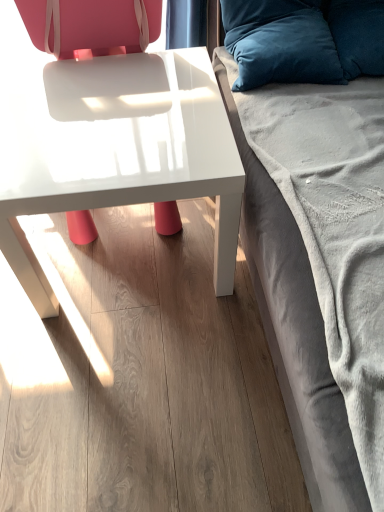
Question: Does velvety blue pillow at upper right, the 2th pillow when ordered from left to right, lie behind velvet gray studio couch at right?

Choices:
 (A) yes
 (B) no

Answer: (A)

Question: Would you say velvety blue pillow at upper right, acting as the 1th pillow starting from the right, contains velvet gray studio couch at right?

Choices:
 (A) yes
 (B) no

Answer: (B)

Question: Does velvety blue pillow at upper right, the 2th pillow when ordered from left to right, have a smaller size compared to velvet gray studio couch at right?

Choices:
 (A) yes
 (B) no

Answer: (A)

Question: Is velvety blue pillow at upper right, acting as the 1th pillow starting from the right, turned away from velvet gray studio couch at right?

Choices:
 (A) no
 (B) yes

Answer: (A)

Question: Does velvety blue pillow at upper right, acting as the 1th pillow starting from the right, have a lesser height compared to velvet gray studio couch at right?

Choices:
 (A) yes
 (B) no

Answer: (A)

Question: Is velvet gray studio couch at right in front of or behind velvety blue pillow at upper right, which is the 2th pillow from right to left, in the image?

Choices:
 (A) behind
 (B) front

Answer: (B)

Question: Considering the relative positions of velvet gray studio couch at right and velvety blue pillow at upper right, which is the 2th pillow from right to left, in the image provided, is velvet gray studio couch at right to the left or to the right of velvety blue pillow at upper right, which is the 2th pillow from right to left,?

Choices:
 (A) left
 (B) right

Answer: (B)

Question: From the image's perspective, is velvet gray studio couch at right located above or below velvety blue pillow at upper right, which is the 2th pillow from right to left?

Choices:
 (A) above
 (B) below

Answer: (B)

Question: Is velvet gray studio couch at right wider or thinner than velvety blue pillow at upper right, the first pillow positioned from the left?

Choices:
 (A) wide
 (B) thin

Answer: (B)

Question: Is point (296, 42) positioned closer to the camera than point (316, 117)?

Choices:
 (A) closer
 (B) farther

Answer: (B)

Question: From a real-world perspective, relative to velvet gray studio couch at right, is velvety blue pillow at upper right, the first pillow positioned from the left, vertically above or below?

Choices:
 (A) above
 (B) below

Answer: (A)

Question: Is velvety blue pillow at upper right, the first pillow positioned from the left, to the left or to the right of velvet gray studio couch at right in the image?

Choices:
 (A) right
 (B) left

Answer: (B)

Question: Relative to velvet gray studio couch at right, is velvety blue pillow at upper right, the first pillow positioned from the left, in front or behind?

Choices:
 (A) front
 (B) behind

Answer: (B)

Question: Looking at their shapes, would you say velvety blue pillow at upper right, which is the 2th pillow from right to left, is wider or thinner than matte white chair at center?

Choices:
 (A) wide
 (B) thin

Answer: (A)

Question: Is point (235, 45) closer or farther from the camera than point (66, 31)?

Choices:
 (A) closer
 (B) farther

Answer: (A)